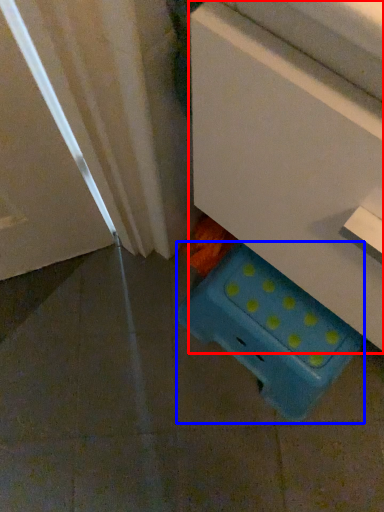
Question: Which point is further to the camera, furniture (highlighted by a red box) or storage box (highlighted by a blue box)?

Choices:
 (A) furniture
 (B) storage box

Answer: (B)